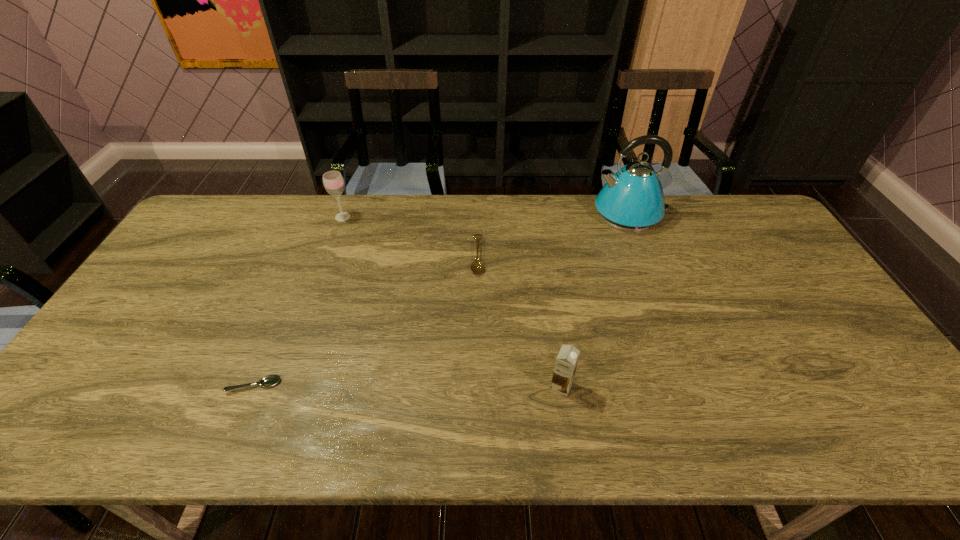
Select which object appears as the fourth closest to the kettle. Please provide its 2D coordinates. Your answer should be formatted as a tuple, i.e. [(x, y)], where the tuple contains the x and y coordinates of a point satisfying the conditions above.

[(270, 380)]

Locate which object is the third closest to the fourth shortest object. Please provide its 2D coordinates. Your answer should be formatted as a tuple, i.e. [(x, y)], where the tuple contains the x and y coordinates of a point satisfying the conditions above.

[(632, 200)]

The width and height of the screenshot is (960, 540). I want to click on free space that satisfies the following two spatial constraints: 1. on the front side of the wineglass; 2. on the right side of the third nearest object, so click(328, 256).

The image size is (960, 540). Identify the location of free space in the image that satisfies the following two spatial constraints: 1. on the back side of the third farthest object; 2. on the right side of the shortest object. (307, 256).